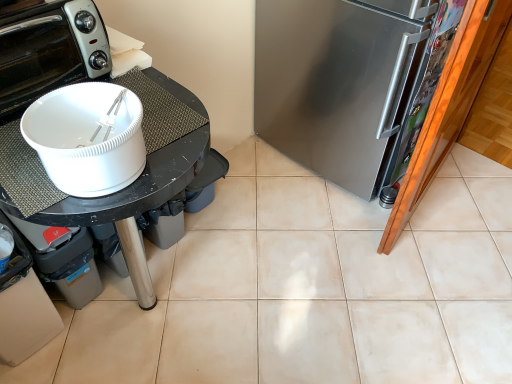
I want to click on vacant area that is in front of satin silver refrigerator at right, so click(x=349, y=241).